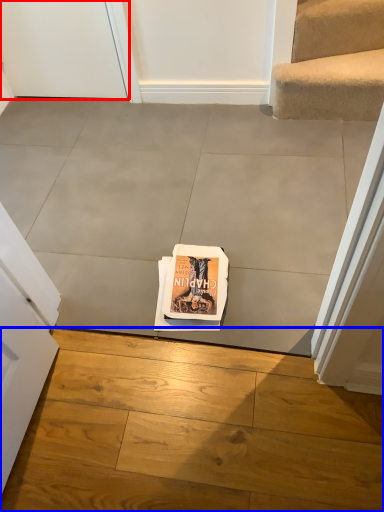
Question: Among these objects, which one is nearest to the camera, door (highlighted by a red box) or concrete (highlighted by a blue box)?

Choices:
 (A) door
 (B) concrete

Answer: (B)